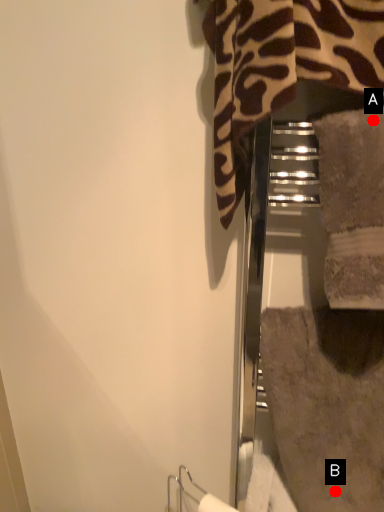
Question: Two points are circled on the image, labeled by A and B beside each circle. Which point appears closest to the camera in this image?

Choices:
 (A) A is closer
 (B) B is closer

Answer: (A)